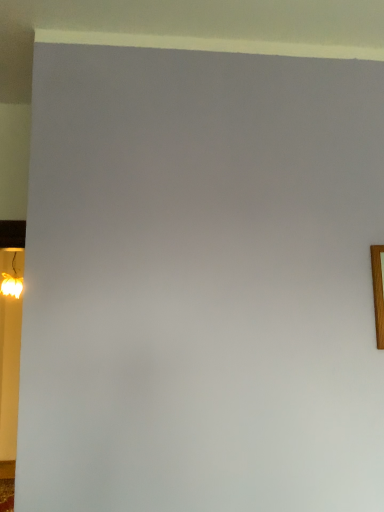
This screenshot has height=512, width=384. What do you see at coordinates (378, 291) in the screenshot?
I see `wooden picture frame at right` at bounding box center [378, 291].

Locate an element on the screen. wooden picture frame at right is located at coordinates (378, 291).

Identify the location of wooden picture frame at right. The width and height of the screenshot is (384, 512). (378, 291).